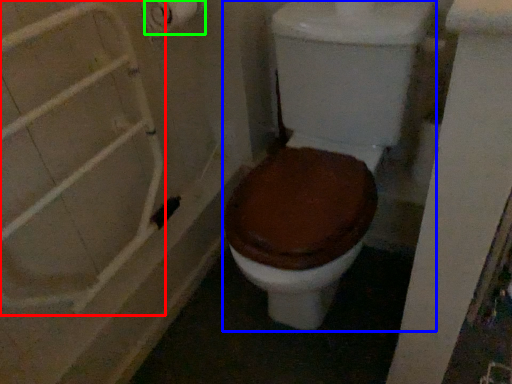
Question: Estimate the real-world distances between objects in this image. Which object is closer to shower door (highlighted by a red box), toilet (highlighted by a blue box) or toilet paper (highlighted by a green box)?

Choices:
 (A) toilet
 (B) toilet paper

Answer: (B)